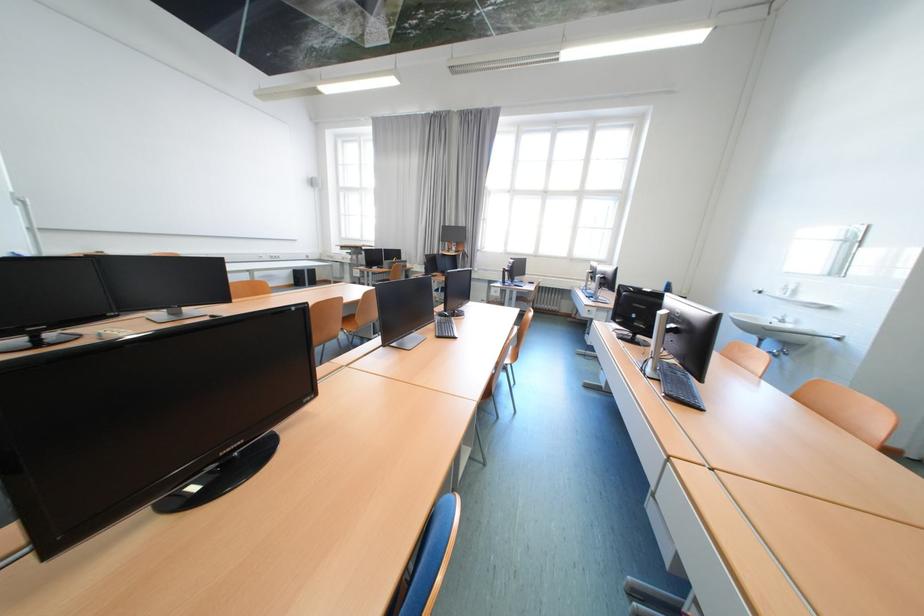
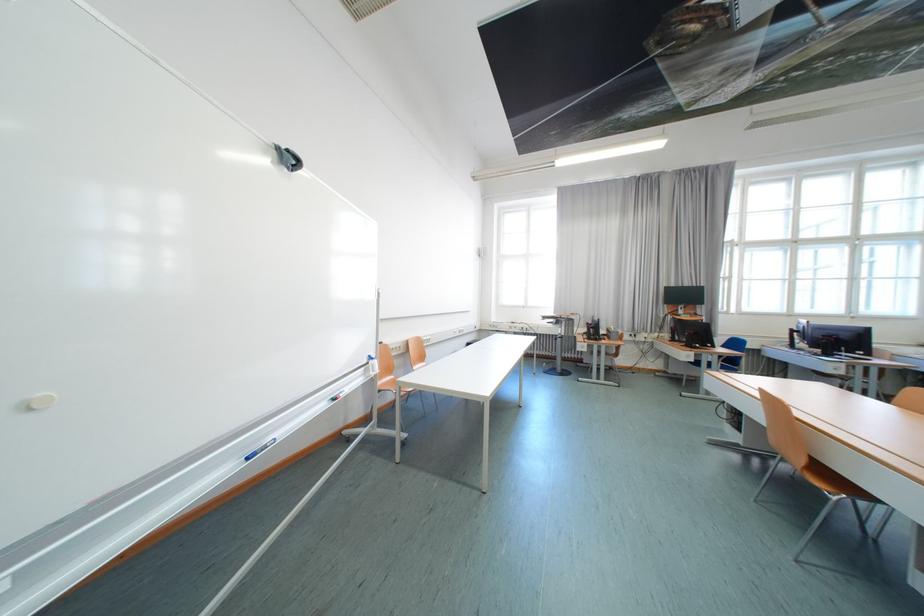
Question: In a continuous first-person perspective shot, in which direction is the camera moving?

Choices:
 (A) Left
 (B) Right
 (C) Forward
 (D) Backward

Answer: (A)